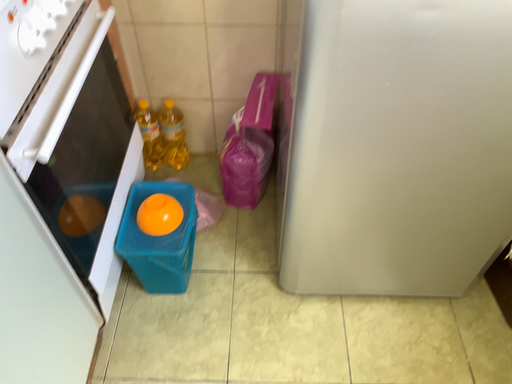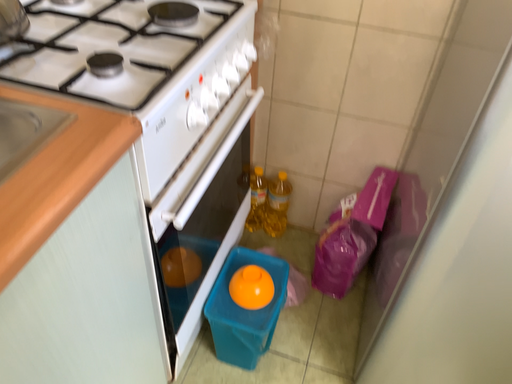
Question: How did the camera likely rotate when shooting the video?

Choices:
 (A) rotated downward
 (B) rotated upward

Answer: (B)